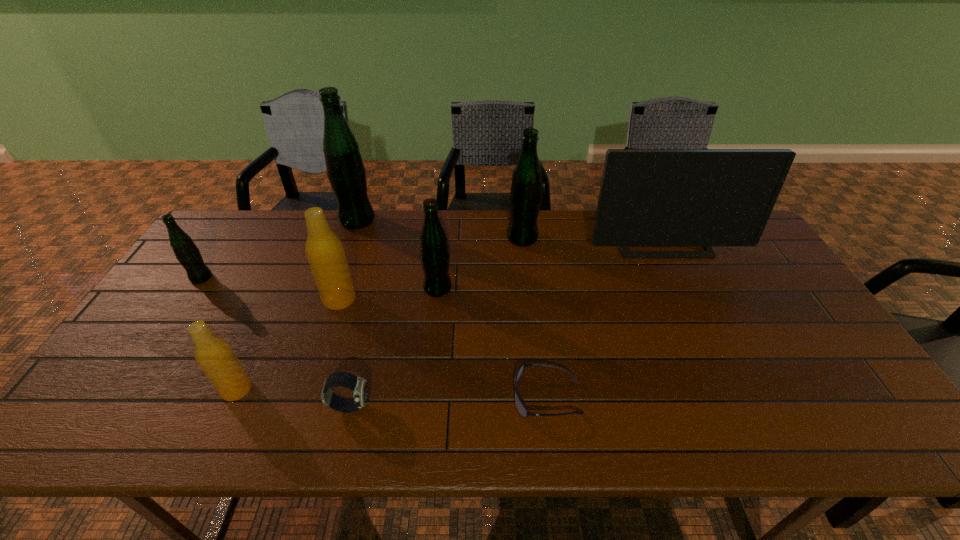
The width and height of the screenshot is (960, 540). Identify the location of sunglasses that is at the near edge. pos(522,410).

Find the location of `object situated at the left edge`. object situated at the left edge is located at coordinates (187, 253).

I want to click on object situated at the right edge, so click(648, 197).

Where is `object that is at the far right corner`? object that is at the far right corner is located at coordinates (648, 197).

In the image, there is a desktop. At what (x,y) coordinates should I click in order to perform the action: click on free space at the far edge. Please return your answer as a coordinate pair (x, y). Looking at the image, I should click on (470, 237).

Identify the location of vacant space at the near edge of the desktop. (266, 416).

In the image, there is a desktop. Where is `vacant area at the left edge`? This screenshot has width=960, height=540. vacant area at the left edge is located at coordinates (149, 389).

Find the location of a particular element. The height and width of the screenshot is (540, 960). vacant space at the right edge of the desktop is located at coordinates (751, 290).

The image size is (960, 540). What are the coordinates of `free region at the far left corner of the desktop` in the screenshot? It's located at (207, 245).

I want to click on vacant space at the near right corner of the desktop, so click(x=878, y=413).